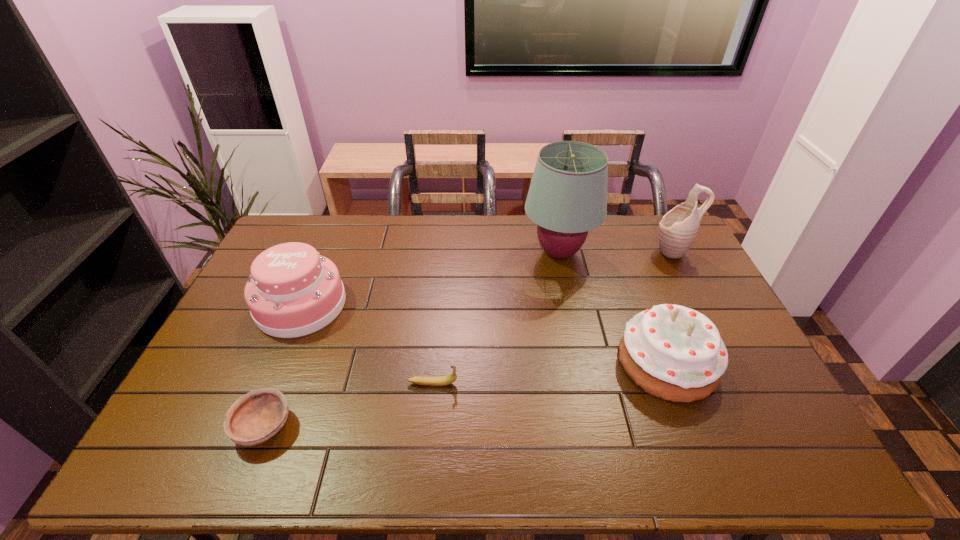
In order to click on free space that is in between the right cake and the tallest object in this screenshot , I will do `click(613, 307)`.

The width and height of the screenshot is (960, 540). Find the location of `vacant space that's between the shortest object and the left cake`. vacant space that's between the shortest object and the left cake is located at coordinates (282, 366).

I want to click on free space between the right cake and the left cake, so click(x=484, y=334).

The width and height of the screenshot is (960, 540). Find the location of `free space between the lampshade and the bowl`. free space between the lampshade and the bowl is located at coordinates (411, 339).

Locate an element on the screen. The height and width of the screenshot is (540, 960). empty location between the right cake and the fourth object from right to left is located at coordinates (550, 373).

Find the location of a particular element. The image size is (960, 540). vacant region between the right cake and the lampshade is located at coordinates (613, 307).

Locate an element on the screen. The width and height of the screenshot is (960, 540). object that stands as the third closest to the left cake is located at coordinates (567, 197).

Locate which object is the fourth closest to the left cake. Please provide its 2D coordinates. Your answer should be formatted as a tuple, i.e. [(x, y)], where the tuple contains the x and y coordinates of a point satisfying the conditions above.

[(675, 353)]

Identify the location of vacant space that satisfies the following two spatial constraints: 1. on the front side of the left cake; 2. on the left side of the bowl. (250, 426).

Locate an element on the screen. This screenshot has width=960, height=540. free space that satisfies the following two spatial constraints: 1. on the back side of the tallest object; 2. on the right side of the left cake is located at coordinates (323, 253).